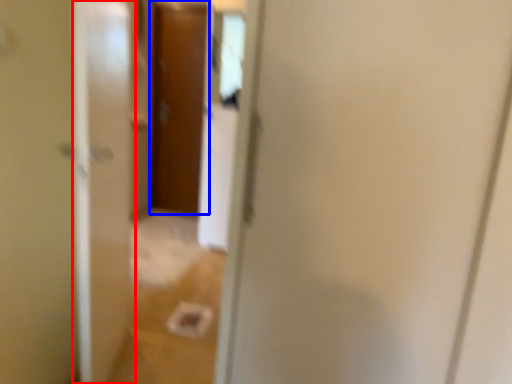
Question: Which of the following is the farthest to the observer, screen door (highlighted by a red box) or door (highlighted by a blue box)?

Choices:
 (A) screen door
 (B) door

Answer: (B)